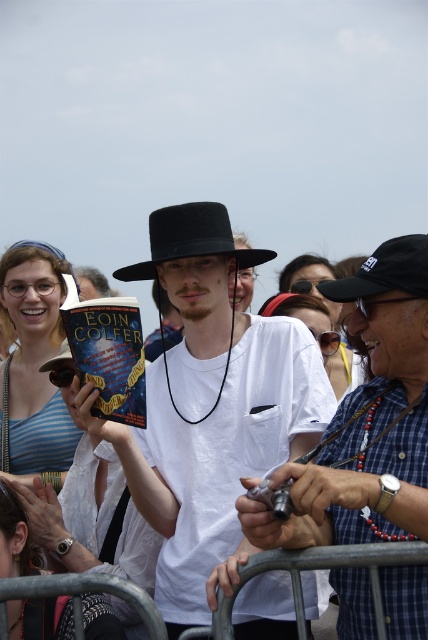
Between point (287, 422) and point (158, 236), which one is positioned in front?

Point (287, 422) is in front.

Looking at this image, between white matte shirt at center and black felt fedora at center, which one has less height?

With less height is black felt fedora at center.

Which is in front, point (223, 234) or point (258, 253)?

Point (223, 234)

This screenshot has width=428, height=640. I want to click on white matte shirt at center, so click(211, 406).

Is matte black hat at center below black fabric cap at center?

Indeed, matte black hat at center is positioned under black fabric cap at center.

Which is more to the right, matte black hat at center or black fabric cap at center?

matte black hat at center is more to the right.

Which is in front, point (323, 545) or point (377, 246)?

Point (323, 545) is in front.

This screenshot has height=640, width=428. In order to click on matte black hat at center in this screenshot , I will do `click(366, 419)`.

Can you confirm if white matte shirt at center is smaller than black fabric cap at center?

No.

Is white matte shirt at center closer to the viewer compared to black fabric cap at center?

Yes.

You are a GUI agent. You are given a task and a screenshot of the screen. Output one action in this format:
    pyautogui.click(x=<x>, y=<y>)
    Task: Click on the white matte shirt at center
    This screenshot has width=428, height=640.
    Given the screenshot: What is the action you would take?
    pyautogui.click(x=211, y=406)